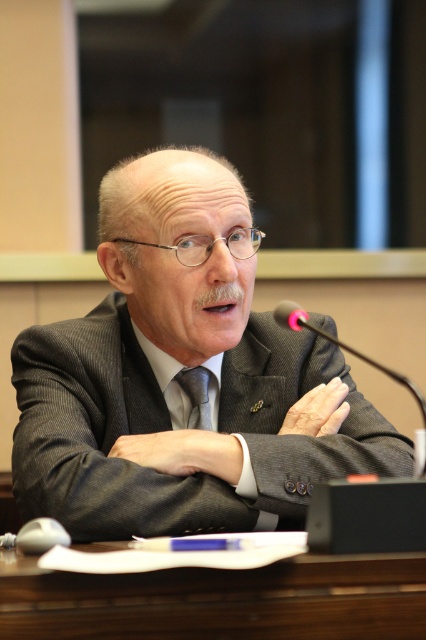
You are a photographer trying to capture a closeup of the man seated at the table. The camera you are using has a very narrow field of view, so you can only see a small portion of the scene. Your current view is centered at point (178, 371). What object will be visible in your current view?

The point (178, 371) is on the matte gray suit at center, so the visible object in your current view is the matte gray suit at center.

You are a photographer adjusting your camera to focus on two points in the scene. The first point is at coordinates point [267,502] and the second point is at coordinates point [209,372]. Which point should you focus on first if you want to capture the closest object to the camera?

Point [267,502] is closer to the camera than point [209,372], so you should focus on point [267,502] first to capture the closest object.